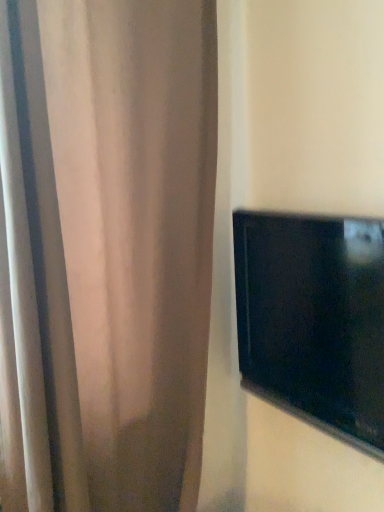
What do you see at coordinates (314, 320) in the screenshot?
I see `black glossy tv at right` at bounding box center [314, 320].

The height and width of the screenshot is (512, 384). I want to click on black glossy tv at right, so click(x=314, y=320).

The image size is (384, 512). I want to click on black glossy tv at right, so click(x=314, y=320).